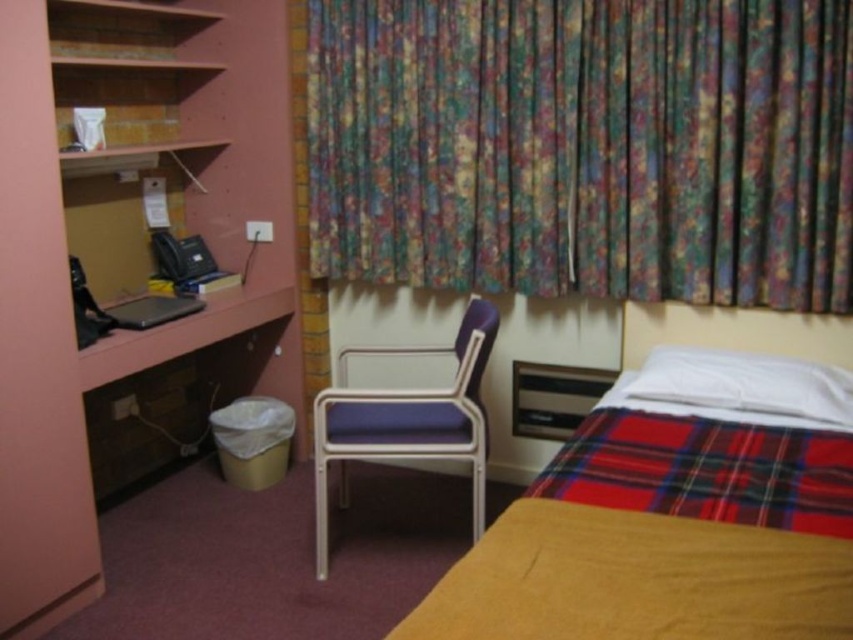
Is floral fabric curtain at upper center smaller than matte pink bookshelf at left?

Yes.

This screenshot has width=853, height=640. What do you see at coordinates (585, 147) in the screenshot? I see `floral fabric curtain at upper center` at bounding box center [585, 147].

Find the location of `floral fabric curtain at upper center`. floral fabric curtain at upper center is located at coordinates (585, 147).

Consider the image. Between matte pink bookshelf at left and plaid fabric bed at lower right, which one appears on the left side from the viewer's perspective?

matte pink bookshelf at left is more to the left.

Is point (6, 538) closer to viewer compared to point (788, 564)?

No, it is behind (788, 564).

Find the location of a particular element. matte pink bookshelf at left is located at coordinates (126, 332).

Does plaid fabric bed at lower right lie in front of purple fabric chair at center?

Yes, it is in front of purple fabric chair at center.

Is plaid fabric bed at lower right smaller than purple fabric chair at center?

Indeed, plaid fabric bed at lower right has a smaller size compared to purple fabric chair at center.

What do you see at coordinates (636, 580) in the screenshot? I see `plaid fabric bed at lower right` at bounding box center [636, 580].

Identify the location of plaid fabric bed at lower right. (636, 580).